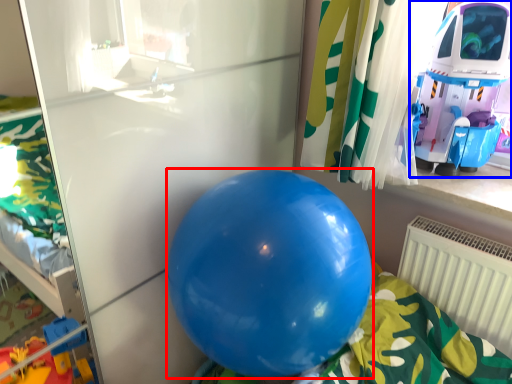
Question: Among these objects, which one is nearest to the camera, balloon (highlighted by a red box) or toy (highlighted by a blue box)?

Choices:
 (A) balloon
 (B) toy

Answer: (A)